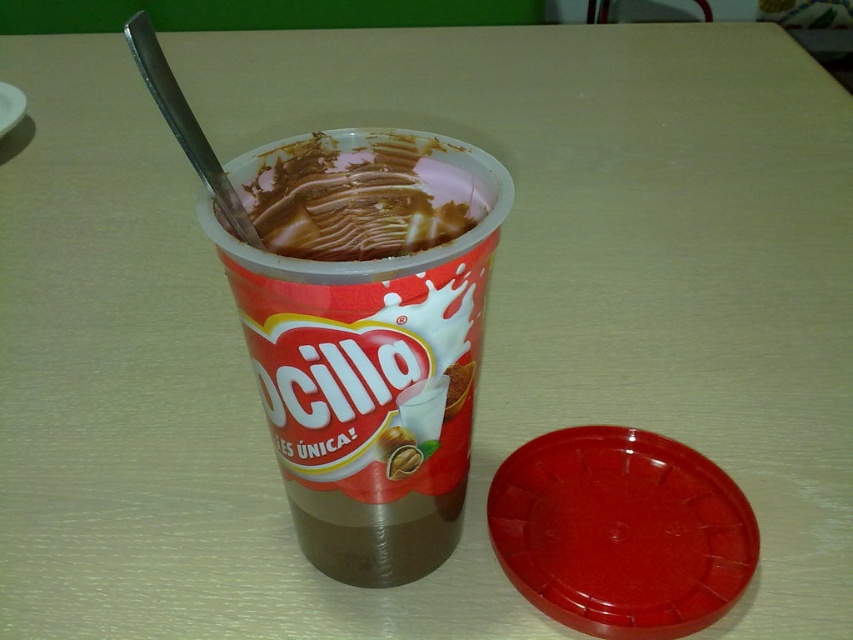
Does brown matte plastic cup at center have a smaller size compared to chocolate creamy ice cream at center?

Actually, brown matte plastic cup at center might be larger than chocolate creamy ice cream at center.

Measure the distance between brown matte plastic cup at center and camera.

26.61 inches

Where is `brown matte plastic cup at center`? This screenshot has height=640, width=853. brown matte plastic cup at center is located at coordinates (367, 333).